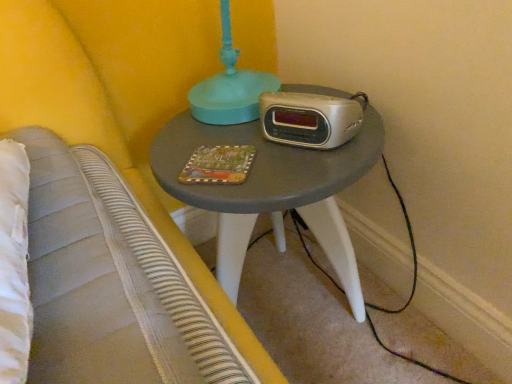
In order to click on free space between silver metallic clock radio at center and matte painted wood book at center in this screenshot , I will do pos(267,149).